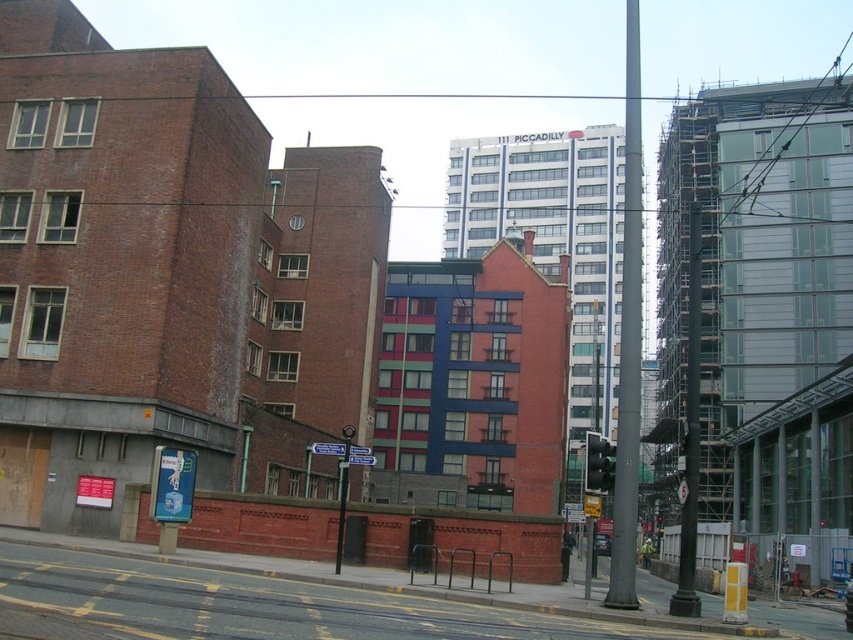
Is metallic gray pole at center shorter than black glass traffic light at center?

No.

Find the location of a particular element. The width and height of the screenshot is (853, 640). metallic gray pole at center is located at coordinates (628, 340).

Which is in front, point (624, 536) or point (599, 458)?

Point (624, 536) is in front.

Where is `metallic gray pole at center`? metallic gray pole at center is located at coordinates pos(628,340).